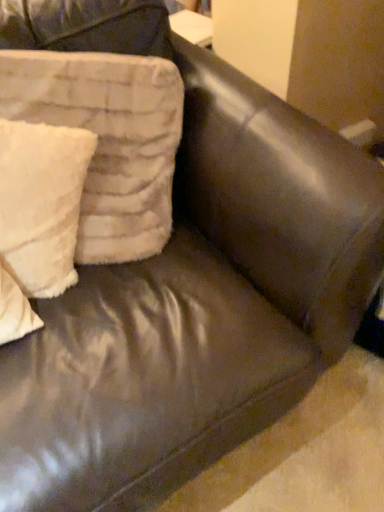
Question: Should I look upward or downward to see white fuzzy pillow at left, which is the 2th pillow from left to right?

Choices:
 (A) up
 (B) down

Answer: (A)

Question: Is white fluffy pillow at left, which ranks as the 2th pillow in right-to-left order, taller than white fuzzy pillow at left, which is the 2th pillow from left to right?

Choices:
 (A) no
 (B) yes

Answer: (A)

Question: From a real-world perspective, is white fluffy pillow at left, which ranks as the 2th pillow in right-to-left order, under white fuzzy pillow at left, marked as the first pillow in a right-to-left arrangement?

Choices:
 (A) no
 (B) yes

Answer: (B)

Question: Can you confirm if white fluffy pillow at left, placed as the 1th pillow when sorted from left to right, is shorter than white fuzzy pillow at left, marked as the first pillow in a right-to-left arrangement?

Choices:
 (A) yes
 (B) no

Answer: (A)

Question: Would you say white fuzzy pillow at left, which is the 2th pillow from left to right, is part of white fluffy pillow at left, placed as the 1th pillow when sorted from left to right,'s contents?

Choices:
 (A) no
 (B) yes

Answer: (A)

Question: From a real-world perspective, is white fluffy pillow at left, which ranks as the 2th pillow in right-to-left order, over white fuzzy pillow at left, which is the 2th pillow from left to right?

Choices:
 (A) no
 (B) yes

Answer: (A)

Question: From the image's perspective, is white fluffy pillow at left, placed as the 1th pillow when sorted from left to right, above white fuzzy pillow at left, marked as the first pillow in a right-to-left arrangement?

Choices:
 (A) yes
 (B) no

Answer: (B)

Question: Is white fuzzy pillow at left, which is the 2th pillow from left to right, facing away from white fluffy pillow at left, which ranks as the 2th pillow in right-to-left order?

Choices:
 (A) yes
 (B) no

Answer: (A)

Question: Can you see white fuzzy pillow at left, which is the 2th pillow from left to right, touching white fluffy pillow at left, placed as the 1th pillow when sorted from left to right?

Choices:
 (A) yes
 (B) no

Answer: (B)

Question: Can you confirm if white fuzzy pillow at left, which is the 2th pillow from left to right, is positioned to the right of white fluffy pillow at left, which ranks as the 2th pillow in right-to-left order?

Choices:
 (A) yes
 (B) no

Answer: (A)

Question: From the image's perspective, does white fuzzy pillow at left, marked as the first pillow in a right-to-left arrangement, appear higher than white fluffy pillow at left, placed as the 1th pillow when sorted from left to right?

Choices:
 (A) no
 (B) yes

Answer: (B)

Question: Considering the relative sizes of white fuzzy pillow at left, marked as the first pillow in a right-to-left arrangement, and white fluffy pillow at left, which ranks as the 2th pillow in right-to-left order, in the image provided, is white fuzzy pillow at left, marked as the first pillow in a right-to-left arrangement, thinner than white fluffy pillow at left, which ranks as the 2th pillow in right-to-left order,?

Choices:
 (A) no
 (B) yes

Answer: (A)

Question: Is white fuzzy pillow at left, marked as the first pillow in a right-to-left arrangement, wider than white fluffy pillow at left, which ranks as the 2th pillow in right-to-left order?

Choices:
 (A) yes
 (B) no

Answer: (A)

Question: In the image, is white fuzzy pillow at left, marked as the first pillow in a right-to-left arrangement, on the left side or the right side of white fluffy pillow at left, placed as the 1th pillow when sorted from left to right?

Choices:
 (A) left
 (B) right

Answer: (B)